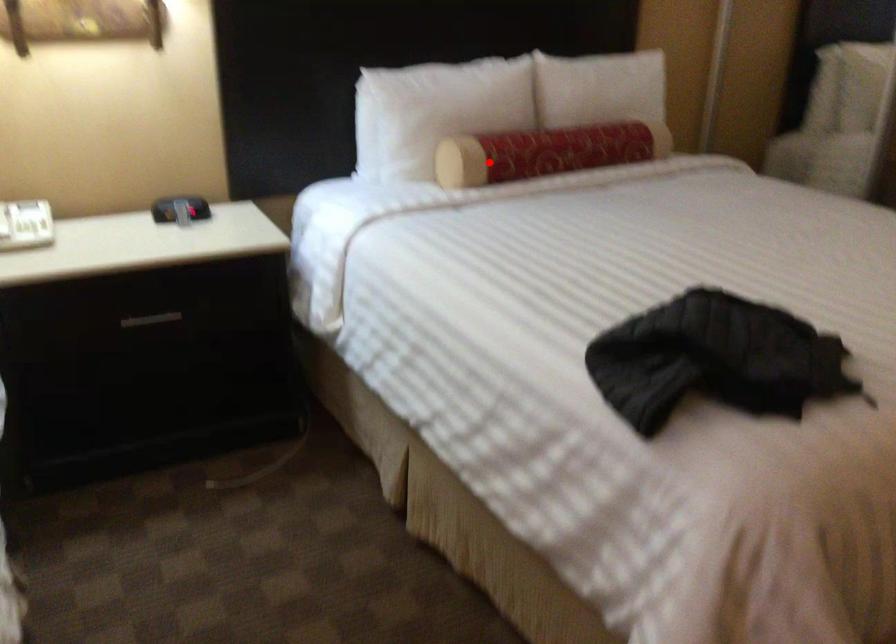
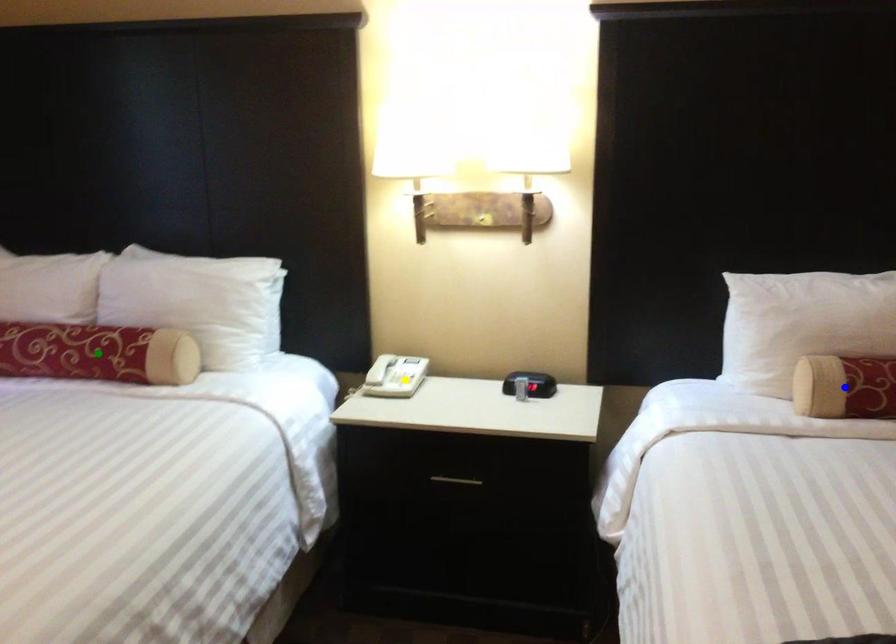
Question: I am providing you with two images of the same scene from different viewpoints. A red point is marked on the first image. You are given multiple points on the second image. In image 2, which mark is for the same physical point as the one in image 1?

Choices:
 (A) blue point
 (B) yellow point
 (C) green point

Answer: (A)